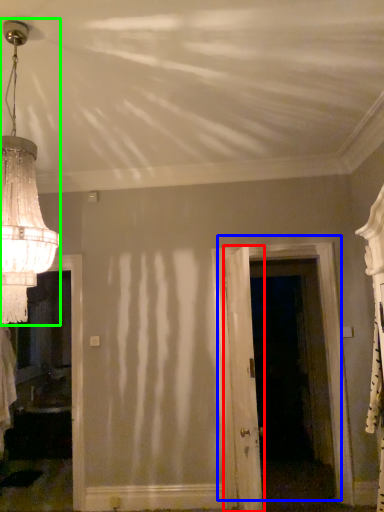
Question: Which object is positioned closest to door (highlighted by a red box)? Select from door (highlighted by a blue box) and lamp (highlighted by a green box).

Choices:
 (A) door
 (B) lamp

Answer: (A)